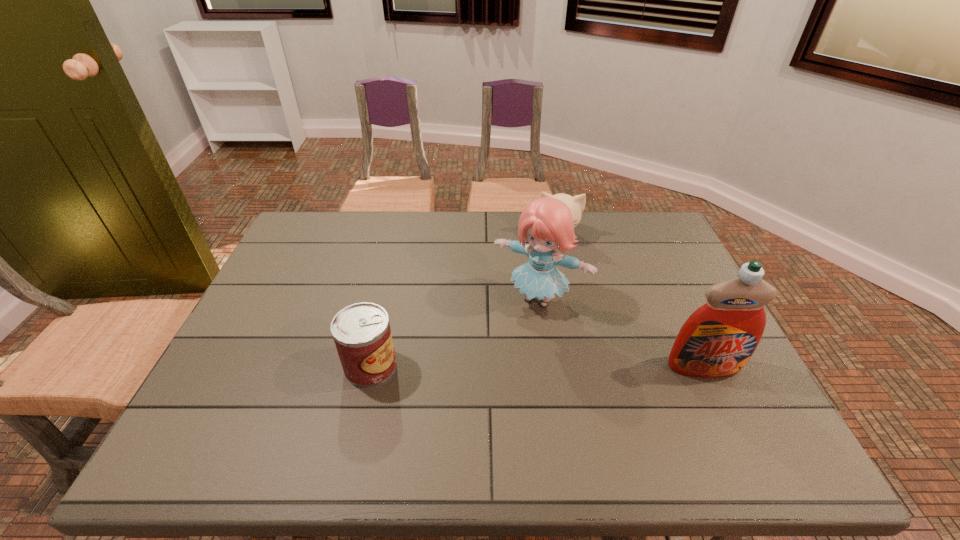
This screenshot has height=540, width=960. In order to click on vacant point located 0.130m on the front-facing side of the doll in this screenshot , I will do `click(499, 351)`.

The height and width of the screenshot is (540, 960). I want to click on vacant space located on the front-facing side of the doll, so click(502, 345).

Where is `object present at the far edge`? object present at the far edge is located at coordinates (576, 204).

At what (x,y) coordinates should I click in order to perform the action: click on object that is positioned at the near edge. Please return your answer as a coordinate pair (x, y). This screenshot has height=540, width=960. Looking at the image, I should click on (362, 334).

Locate an element on the screen. This screenshot has width=960, height=540. object positioned at the right edge is located at coordinates (717, 340).

Where is `vacant space at the far edge`? vacant space at the far edge is located at coordinates coord(504,250).

This screenshot has width=960, height=540. I want to click on vacant space at the left edge, so click(x=322, y=259).

Locate an element on the screen. The image size is (960, 540). vacant region at the right edge of the desktop is located at coordinates (682, 270).

Where is `vacant space at the far left corner of the desktop`? The height and width of the screenshot is (540, 960). vacant space at the far left corner of the desktop is located at coordinates (301, 226).

Identify the location of vacant space in between the detergent and the leftmost object. Image resolution: width=960 pixels, height=540 pixels. (538, 366).